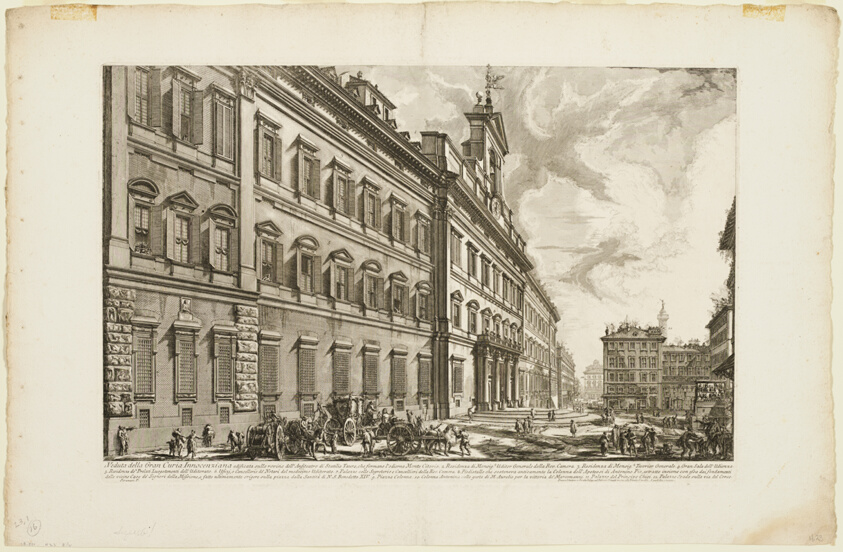
This screenshot has width=843, height=552. What are the coordinates of `wall` in the screenshot? It's located at (200, 394).